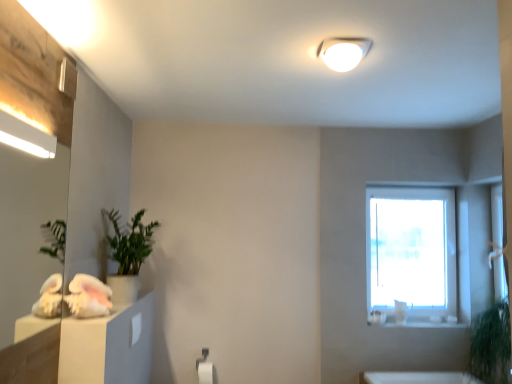
Question: Is green leafy plant at lower right bigger than matte wooden mirror at left?

Choices:
 (A) no
 (B) yes

Answer: (B)

Question: From the image's perspective, is green leafy plant at lower right located above matte wooden mirror at left?

Choices:
 (A) yes
 (B) no

Answer: (B)

Question: Can you confirm if green leafy plant at lower right is positioned to the right of matte wooden mirror at left?

Choices:
 (A) no
 (B) yes

Answer: (B)

Question: Is green leafy plant at lower right positioned far away from matte wooden mirror at left?

Choices:
 (A) yes
 (B) no

Answer: (A)

Question: Is green leafy plant at lower right positioned in front of matte wooden mirror at left?

Choices:
 (A) yes
 (B) no

Answer: (B)

Question: From a real-world perspective, is matte wooden mirror at left positioned above or below green leafy plant at lower right?

Choices:
 (A) below
 (B) above

Answer: (B)

Question: From their relative heights in the image, would you say matte wooden mirror at left is taller or shorter than green leafy plant at lower right?

Choices:
 (A) short
 (B) tall

Answer: (B)

Question: Is matte wooden mirror at left inside or outside of green leafy plant at lower right?

Choices:
 (A) inside
 (B) outside

Answer: (B)

Question: In terms of width, does matte wooden mirror at left look wider or thinner when compared to green leafy plant at lower right?

Choices:
 (A) thin
 (B) wide

Answer: (A)

Question: From the image's perspective, is white glossy light fixture at upper center located above or below green matte plant at left?

Choices:
 (A) below
 (B) above

Answer: (B)

Question: Is white glossy light fixture at upper center bigger or smaller than green matte plant at left?

Choices:
 (A) small
 (B) big

Answer: (A)

Question: Is white glossy light fixture at upper center to the left or to the right of green matte plant at left in the image?

Choices:
 (A) left
 (B) right

Answer: (B)

Question: Is white glossy light fixture at upper center taller or shorter than green matte plant at left?

Choices:
 (A) tall
 (B) short

Answer: (B)

Question: From a real-world perspective, is matte wooden mirror at left positioned above or below green matte plant at left?

Choices:
 (A) below
 (B) above

Answer: (B)

Question: In the image, is matte wooden mirror at left positioned in front of or behind green matte plant at left?

Choices:
 (A) behind
 (B) front

Answer: (B)